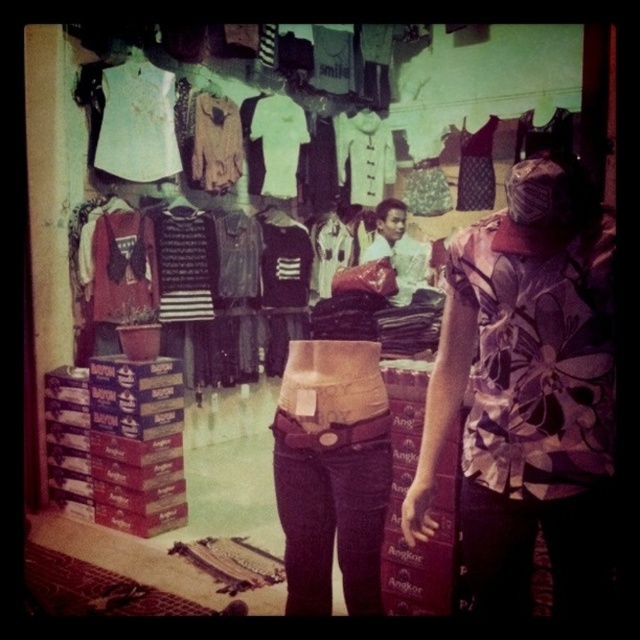
Question: Does black striped sweater at center have a lesser width compared to patterned fabric dress at center?

Choices:
 (A) no
 (B) yes

Answer: (A)

Question: Which of the following is the closest to the observer?

Choices:
 (A) floral-patterned fabric at center-right
 (B) light brown leather jacket at center

Answer: (A)

Question: Which of the following is the closest to the observer?

Choices:
 (A) (589, 522)
 (B) (481, 156)

Answer: (A)

Question: Which object appears farthest from the camera in this image?

Choices:
 (A) floral-patterned fabric at center-right
 (B) black striped sweater at center
 (C) white matte shirt at upper left

Answer: (B)

Question: In this image, where is white matte shirt at center located relative to white textured shirt at center?

Choices:
 (A) below
 (B) above

Answer: (A)

Question: Can you confirm if dark wash denim jeans at center is wider than white textured shirt at center?

Choices:
 (A) no
 (B) yes

Answer: (A)